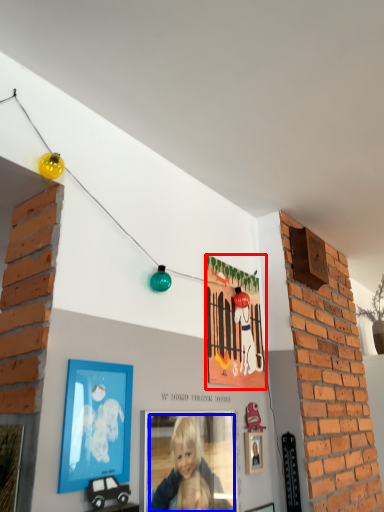
Question: Which object is closer to the camera taking this photo, picture frame (highlighted by a red box) or person (highlighted by a blue box)?

Choices:
 (A) picture frame
 (B) person

Answer: (B)